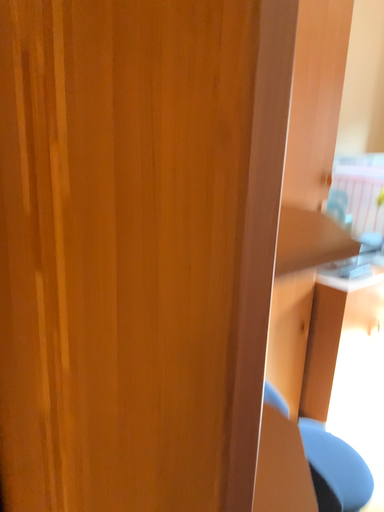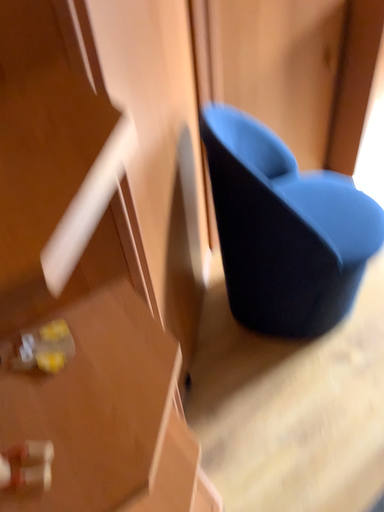
Question: Which way did the camera rotate in the video?

Choices:
 (A) rotated downward
 (B) rotated upward

Answer: (A)